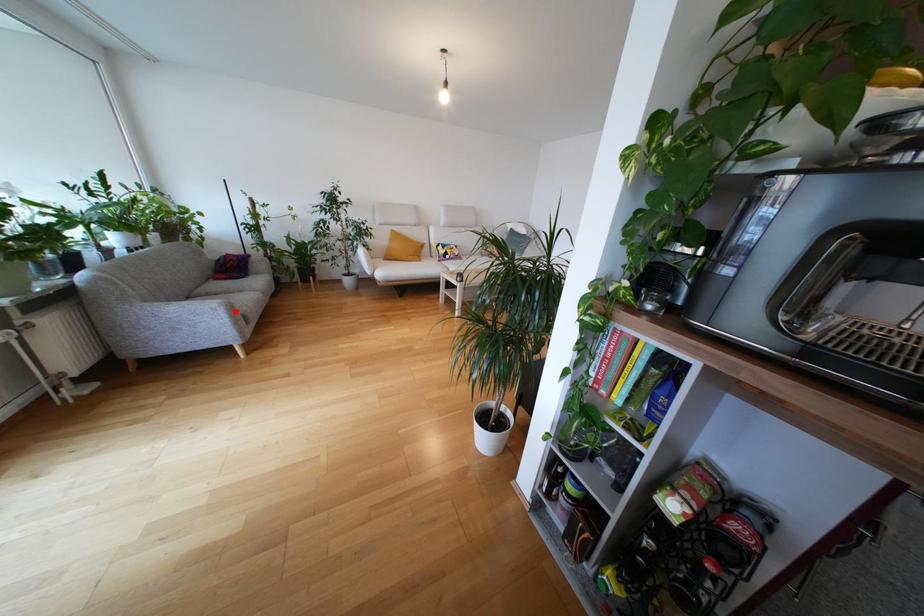
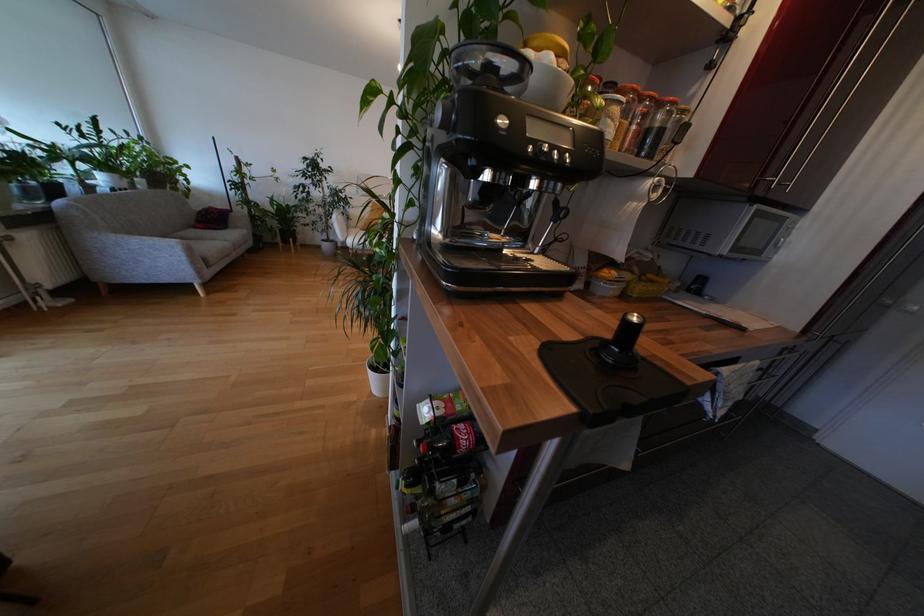
Question: I am providing you with two images of the same scene from different viewpoints. Image1 has a red point marked. In image2, the corresponding 3D location appears at what relative position? Reply with the corresponding letter.

Choices:
 (A) Closer
 (B) Farther

Answer: (B)